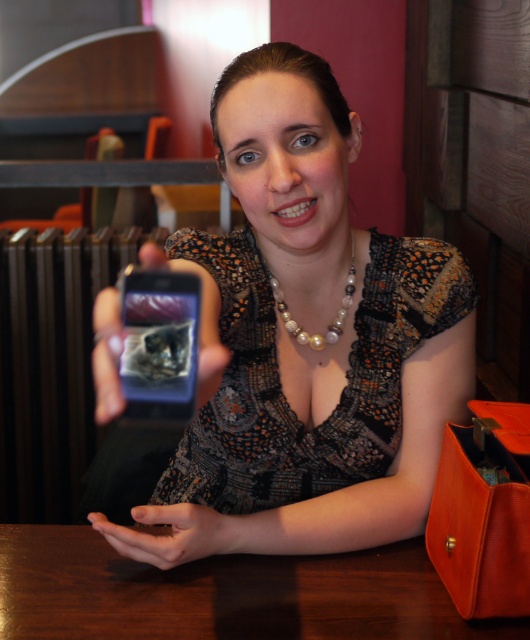
Does matte black phone at center have a lesser height compared to pearl/shell necklace at center?

No, matte black phone at center is not shorter than pearl/shell necklace at center.

Identify the location of matte black phone at center. This screenshot has height=640, width=530. (313, 330).

Between printed fabric dress at center and brown wooden table at lower center, which one appears on the left side from the viewer's perspective?

brown wooden table at lower center

Which of these two, printed fabric dress at center or brown wooden table at lower center, stands shorter?

Standing shorter between the two is brown wooden table at lower center.

Is point (343, 458) farther from viewer compared to point (69, 545)?

Yes, it is behind point (69, 545).

Where is `printed fabric dress at center`? printed fabric dress at center is located at coordinates pos(280,384).

Does satin black phone at center appear on the left side of smooth skin hand at lower center?

Incorrect, satin black phone at center is not on the left side of smooth skin hand at lower center.

Does satin black phone at center have a smaller size compared to smooth skin hand at lower center?

Actually, satin black phone at center might be larger than smooth skin hand at lower center.

Is point (117, 396) closer to viewer compared to point (210, 540)?

Yes, point (117, 396) is closer to viewer.

Where is `satin black phone at center`? This screenshot has width=530, height=640. satin black phone at center is located at coordinates (200, 320).